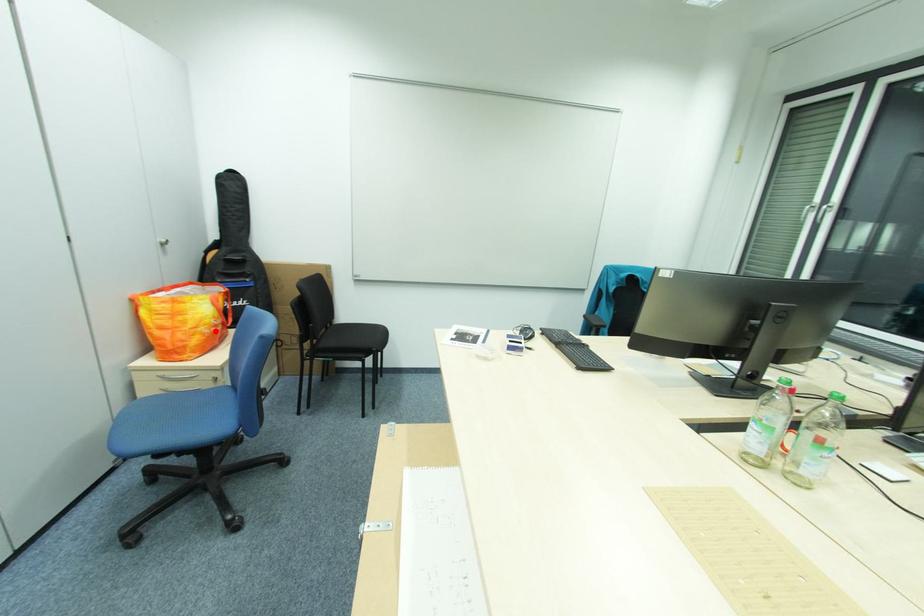
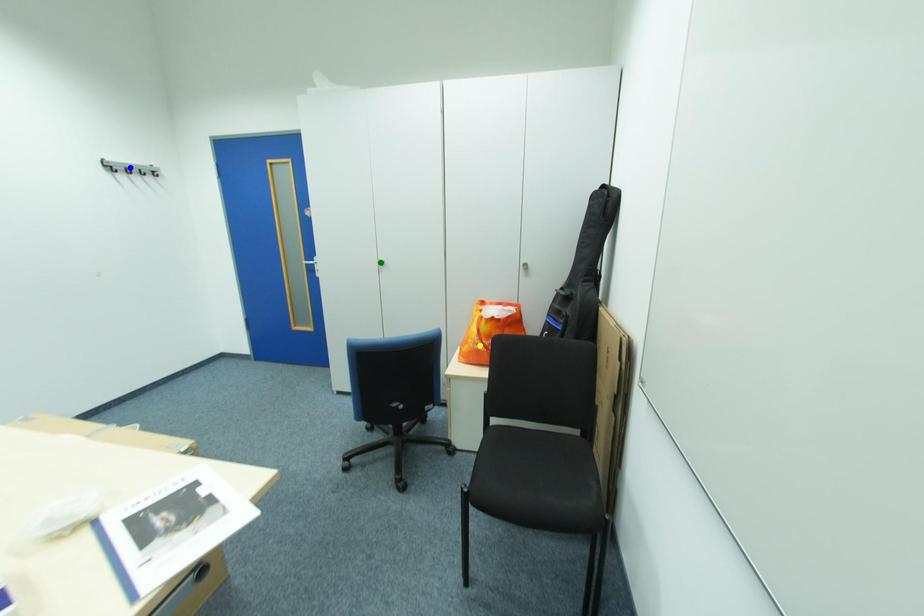
Question: I am providing you with two images of the same scene from different viewpoints. A red point is marked on the first image. You are given multiple points on the second image. Which point in image 2 is actually the same real-world point as the red point in image 1?

Choices:
 (A) yellow point
 (B) blue point
 (C) green point

Answer: (A)